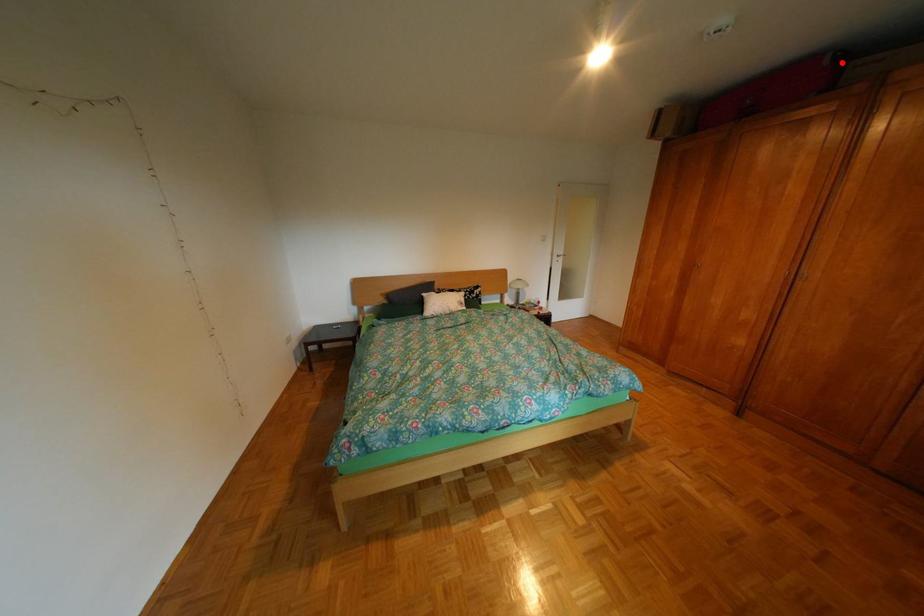
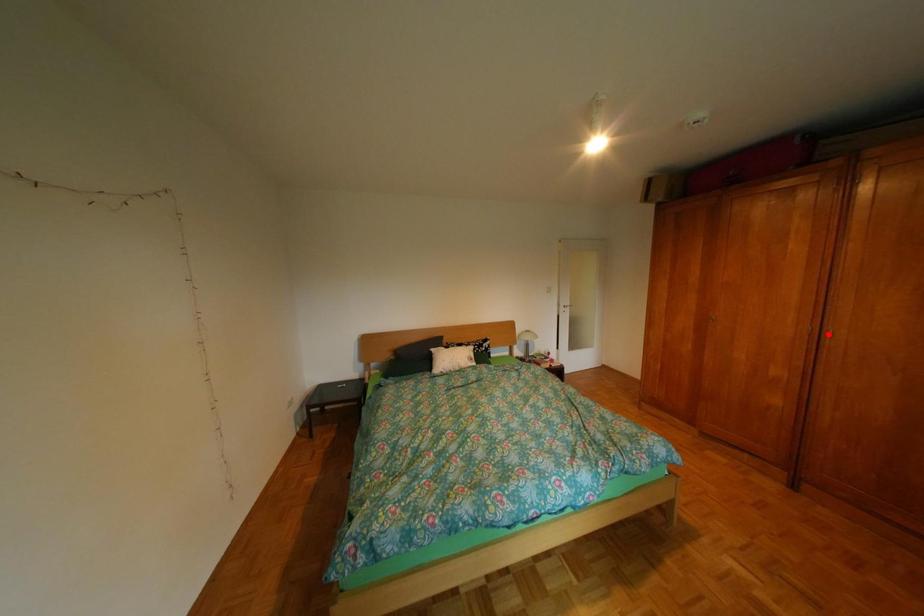
I am providing you with two images of the same scene from different viewpoints. A red point is marked on the first image and another point is marked on the second image. Is the red point in image1 aligned with the point shown in image2?

No